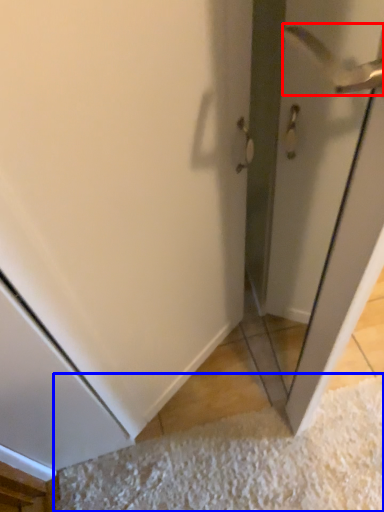
Question: Which object is closer to the camera taking this photo, door handle (highlighted by a red box) or doormat (highlighted by a blue box)?

Choices:
 (A) door handle
 (B) doormat

Answer: (B)